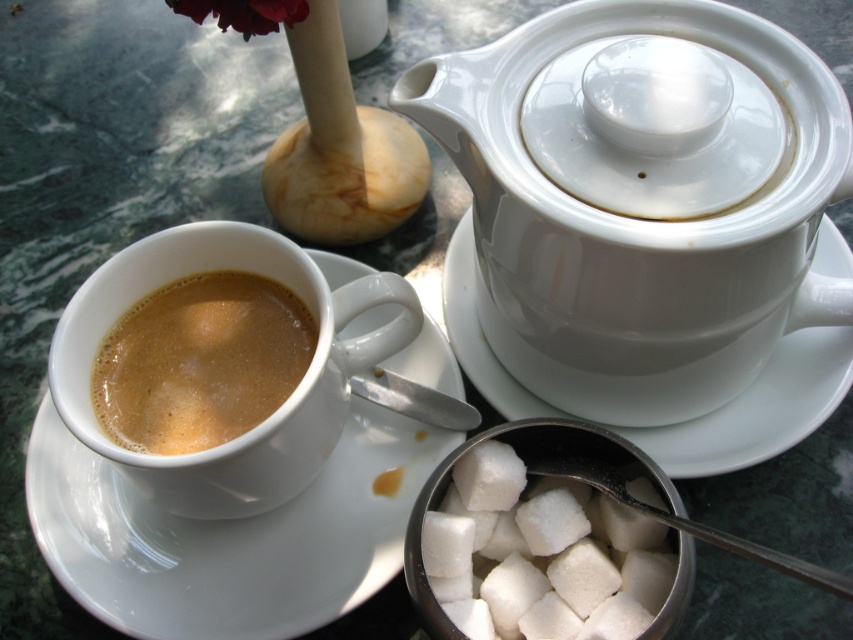
You are a barista preparing a drink and need to place the white sugar cubes at center onto the white ceramic saucer at left. Can you determine if the saucer is wide enough to hold the sugar cubes without them falling off?

The white ceramic saucer at left might be wider than white sugar cubes at center, so there is a possibility that the saucer can accommodate the sugar cubes without them falling off, but the exact dimensions are uncertain.

You are a barista trying to place a new cup on the table. You see the white ceramic saucer at left and the white sugar cubes at center. Which object is closer to you so you can place the cup there?

The white ceramic saucer at left is closer to you than the white sugar cubes at center, so you can place the cup there.

You are a person with a height of 1.7 meters standing in front of the table. The point on the table where you want to place your hand is at coordinate point (x=824, y=417). Can you reach that point without moving your feet?

The point at (x=824, y=417) is 74.54 centimeters away from the viewer. Since the average arm length for a person of 1.7 meters is approximately 70 centimeters, it might be slightly out of reach. Therefore, you might not be able to reach that point without moving your feet.